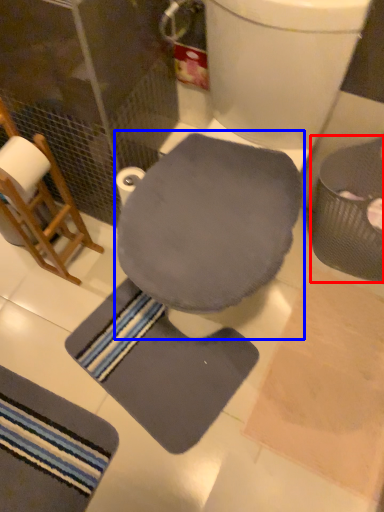
Question: Which point is further to the camera, potty (highlighted by a red box) or swivel chair (highlighted by a blue box)?

Choices:
 (A) potty
 (B) swivel chair

Answer: (A)